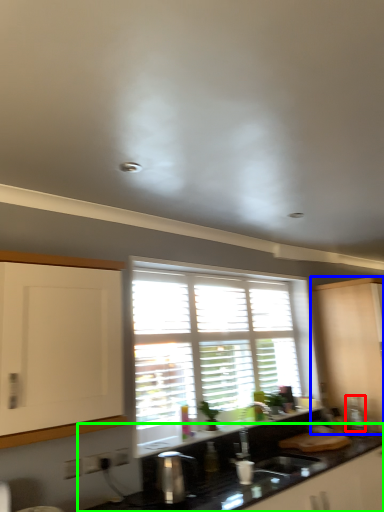
Question: Based on their relative distances, which object is nearer to appliance (highlighted by a red box)? Choose from cabinetry (highlighted by a blue box) and countertop (highlighted by a green box).

Choices:
 (A) cabinetry
 (B) countertop

Answer: (A)